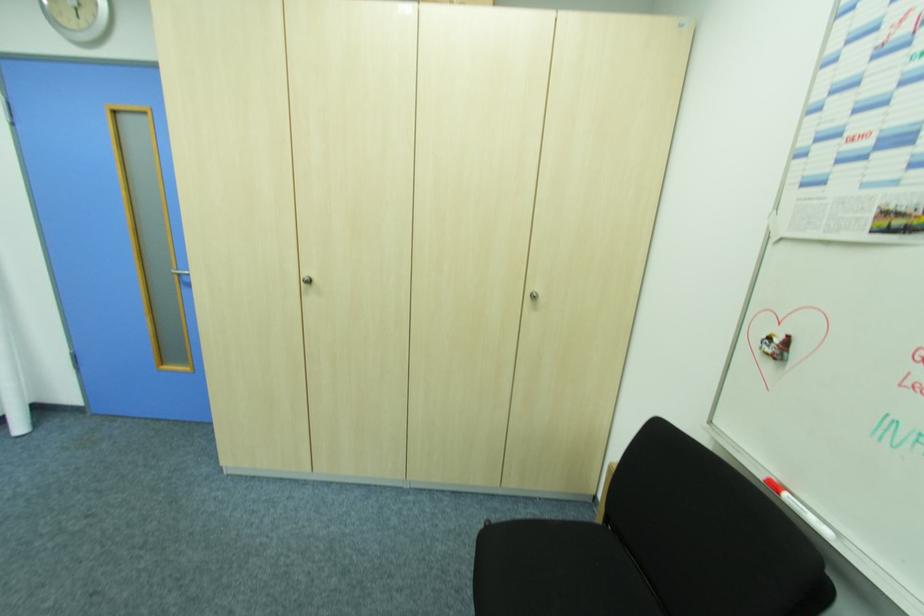
Find where to lift the red whiteboard marker. Please return your answer as a coordinate pair (x, y).

(799, 509)